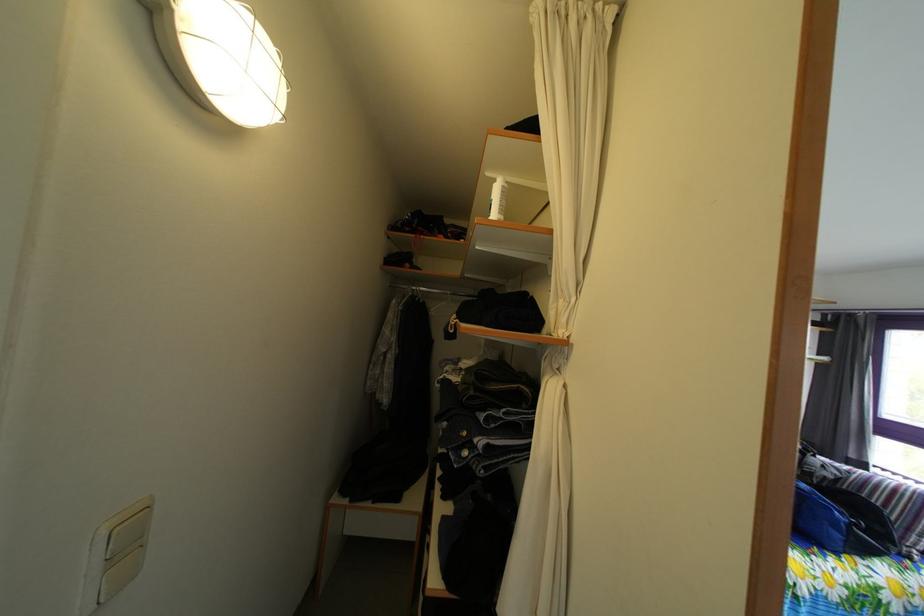
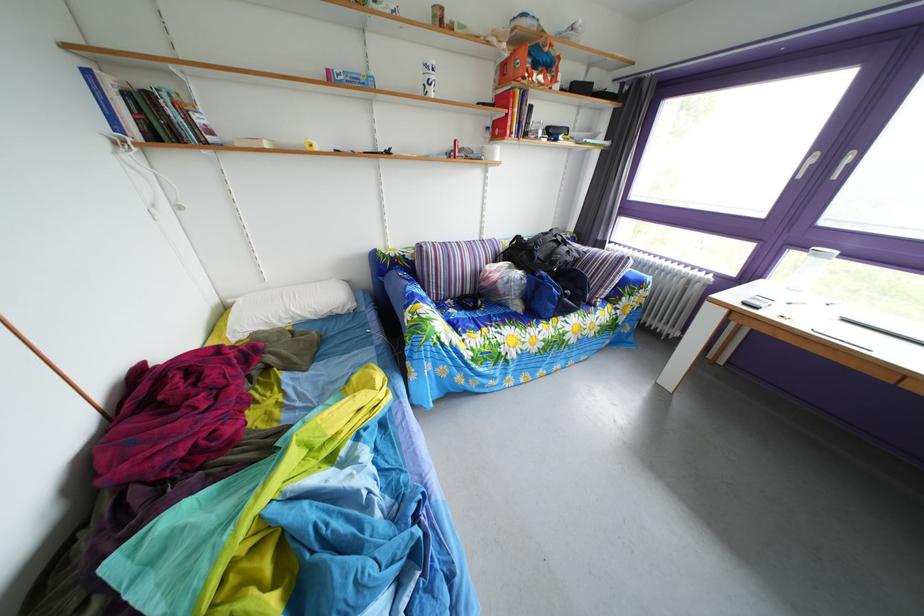
Question: I am providing you with two images of the same scene from different viewpoints. After the viewpoint changes to image2, which objects are now occluded?

Choices:
 (A) striped sofa armrest
 (B) hardcover book
 (C) black backpack
 (D) none of these

Answer: (D)